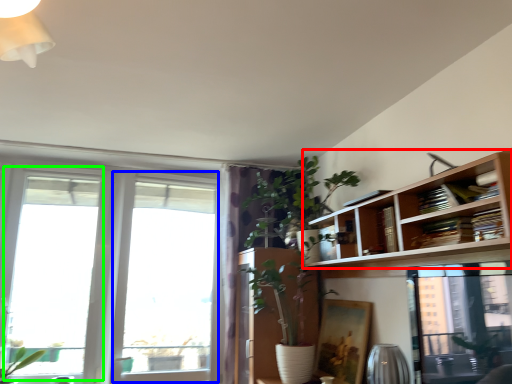
Question: Considering the real-world distances, which object is farthest from bookshelf (highlighted by a red box)? window (highlighted by a blue box) or window (highlighted by a green box)?

Choices:
 (A) window
 (B) window

Answer: (B)